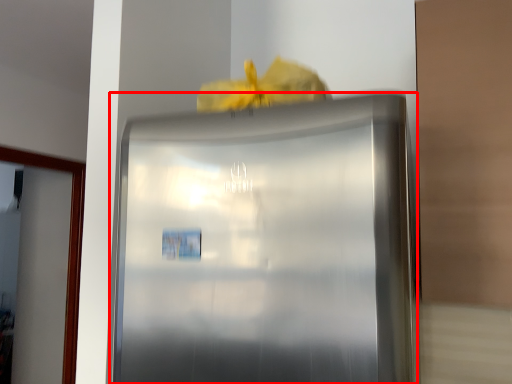
Question: From the image, what is the correct spatial relationship of refrigerator (annotated by the red box) in relation to glass door?

Choices:
 (A) left
 (B) right

Answer: (B)